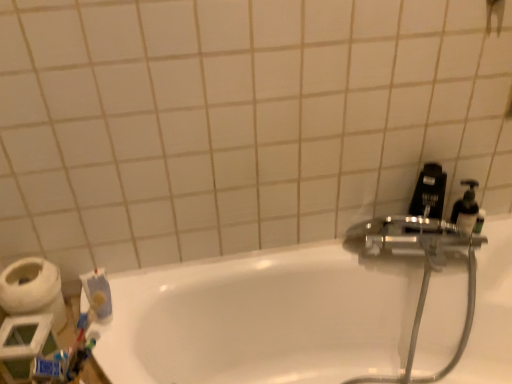
Question: From a real-world perspective, is blue matte toothpaste at lower left physically below white glossy bathtub at center?

Choices:
 (A) yes
 (B) no

Answer: (B)

Question: From the image's perspective, is blue matte toothpaste at lower left located beneath white glossy bathtub at center?

Choices:
 (A) no
 (B) yes

Answer: (A)

Question: Does blue matte toothpaste at lower left have a lesser height compared to white glossy bathtub at center?

Choices:
 (A) no
 (B) yes

Answer: (B)

Question: Are blue matte toothpaste at lower left and white glossy bathtub at center making contact?

Choices:
 (A) no
 (B) yes

Answer: (A)

Question: From a real-world perspective, is blue matte toothpaste at lower left physically above white glossy bathtub at center?

Choices:
 (A) no
 (B) yes

Answer: (B)

Question: In the image, is white matte toilet paper at lower left positioned in front of or behind black plastic soap dispenser at right?

Choices:
 (A) front
 (B) behind

Answer: (A)

Question: Is white matte toilet paper at lower left wider or thinner than black plastic soap dispenser at right?

Choices:
 (A) thin
 (B) wide

Answer: (B)

Question: From their relative heights in the image, would you say white matte toilet paper at lower left is taller or shorter than black plastic soap dispenser at right?

Choices:
 (A) short
 (B) tall

Answer: (A)

Question: Is white matte toilet paper at lower left inside or outside of black plastic soap dispenser at right?

Choices:
 (A) outside
 (B) inside

Answer: (A)

Question: From a real-world perspective, is shiny metallic hose at upper right positioned above or below white glossy bathtub at center?

Choices:
 (A) below
 (B) above

Answer: (B)

Question: Is shiny metallic hose at upper right situated inside white glossy bathtub at center or outside?

Choices:
 (A) outside
 (B) inside

Answer: (B)

Question: Based on their sizes in the image, would you say shiny metallic hose at upper right is bigger or smaller than white glossy bathtub at center?

Choices:
 (A) small
 (B) big

Answer: (A)

Question: Considering their positions, is shiny metallic hose at upper right located in front of or behind white glossy bathtub at center?

Choices:
 (A) behind
 (B) front

Answer: (A)

Question: From a real-world perspective, is shiny metallic hose at upper right physically located above or below blue matte toothpaste at lower left?

Choices:
 (A) above
 (B) below

Answer: (B)

Question: Considering their positions, is shiny metallic hose at upper right located in front of or behind blue matte toothpaste at lower left?

Choices:
 (A) front
 (B) behind

Answer: (A)